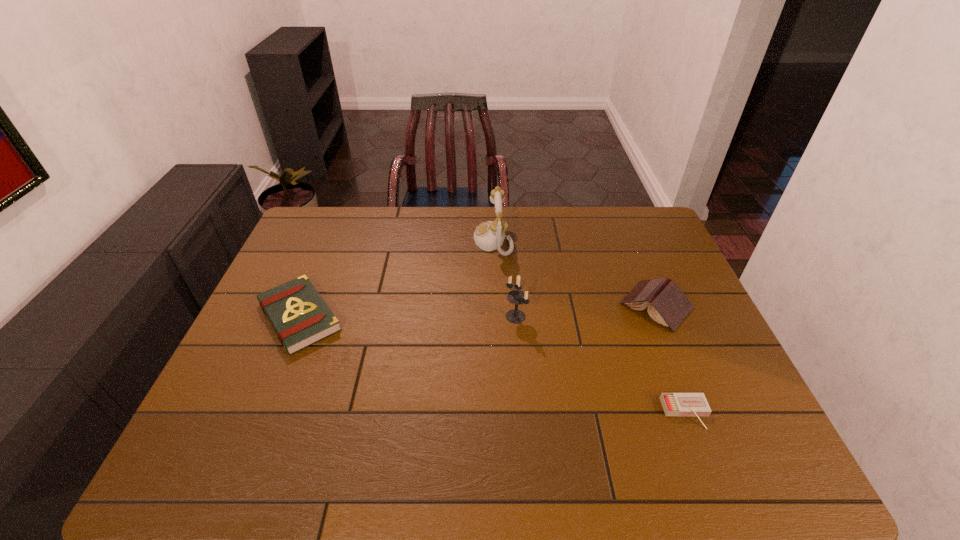
Where is `free space at the near edge`? The width and height of the screenshot is (960, 540). free space at the near edge is located at coordinates (640, 443).

The height and width of the screenshot is (540, 960). In the image, there is a desktop. Find the location of `blank space at the left edge`. blank space at the left edge is located at coordinates 329,255.

The image size is (960, 540). In order to click on free region at the right edge of the desktop in this screenshot , I will do `click(697, 320)`.

Identify the location of free space at the far left corner of the desktop. (323, 211).

In the image, there is a desktop. Where is `vacant region at the near left corner`? The width and height of the screenshot is (960, 540). vacant region at the near left corner is located at coordinates (181, 475).

Where is `vacant point at the far right corner`? The width and height of the screenshot is (960, 540). vacant point at the far right corner is located at coordinates (607, 208).

Find the location of a particular element. The image size is (960, 540). vacant space in between the farthest object and the nearest object is located at coordinates (589, 327).

Identify the location of free area in between the third tallest object and the farthest object. This screenshot has width=960, height=540. pos(575,273).

Where is `free area in between the right book and the candle holder`? free area in between the right book and the candle holder is located at coordinates (586, 311).

Identify the location of free point between the candle holder and the taller book. (586, 311).